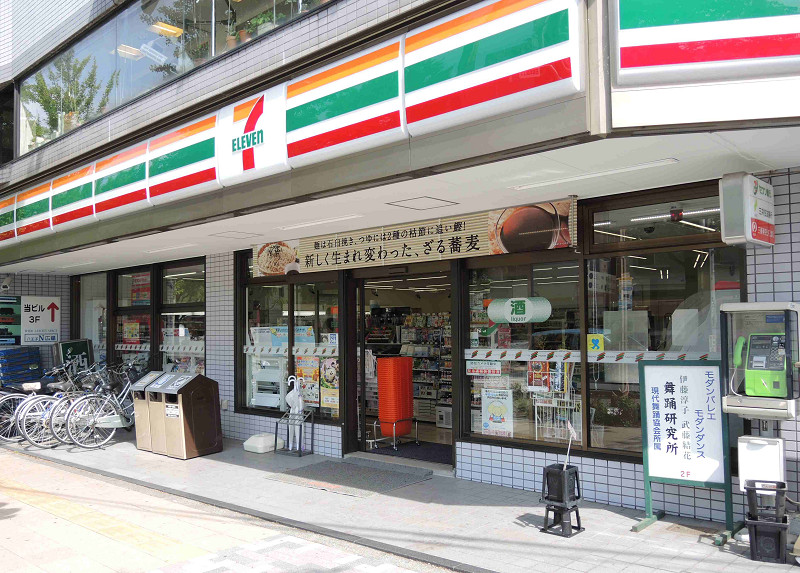
Where is `lights on top floor`? Image resolution: width=800 pixels, height=573 pixels. lights on top floor is located at coordinates pyautogui.click(x=170, y=25), pyautogui.click(x=122, y=54).